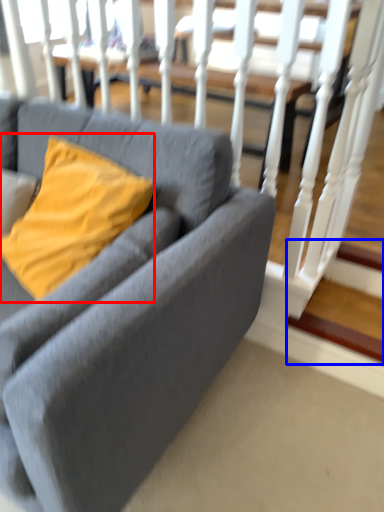
Question: Which object is closer to the camera taking this photo, pillow (highlighted by a red box) or stairwell (highlighted by a blue box)?

Choices:
 (A) pillow
 (B) stairwell

Answer: (A)